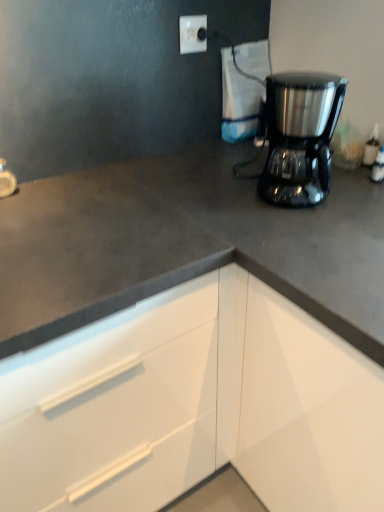
At what (x,y) coordinates should I click in order to perform the action: click on free space to the left of satin black coffee maker at upper right. Please return your answer as a coordinate pair (x, y). Looking at the image, I should click on (217, 198).